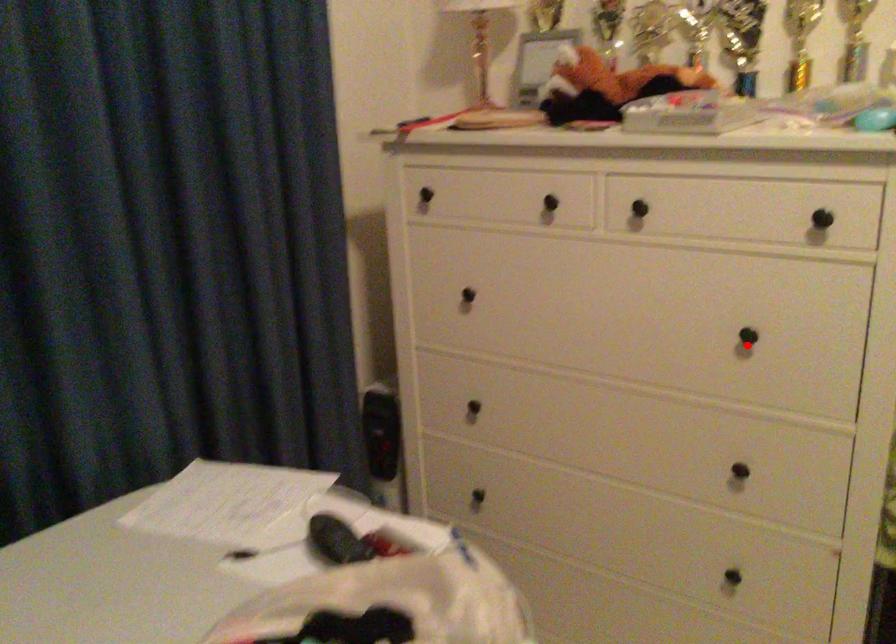
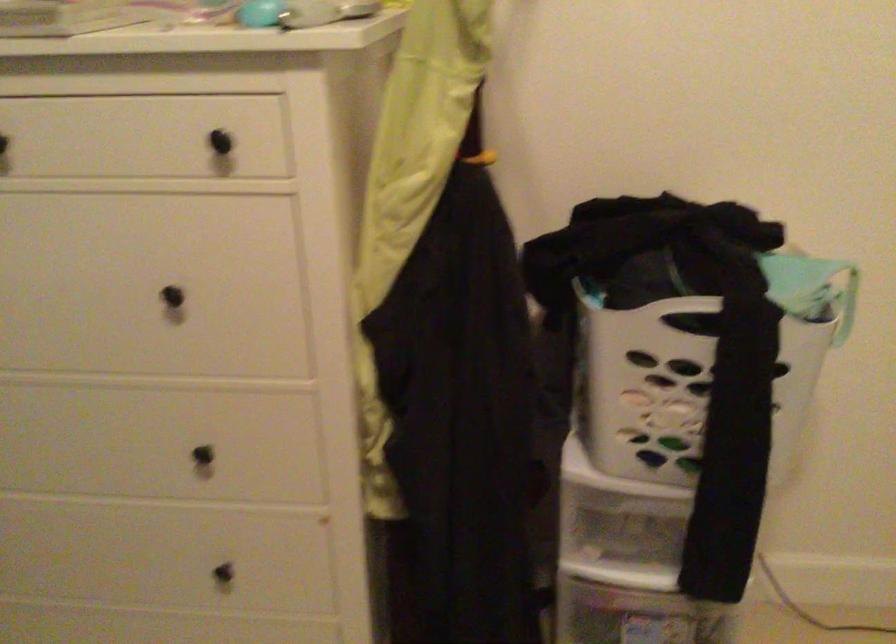
Question: I am providing you with two images of the same scene from different viewpoints. Image1 has a red point marked. In image2, the corresponding 3D location appears at what relative position? Reply with the corresponding letter.

Choices:
 (A) Closer
 (B) Farther

Answer: (A)